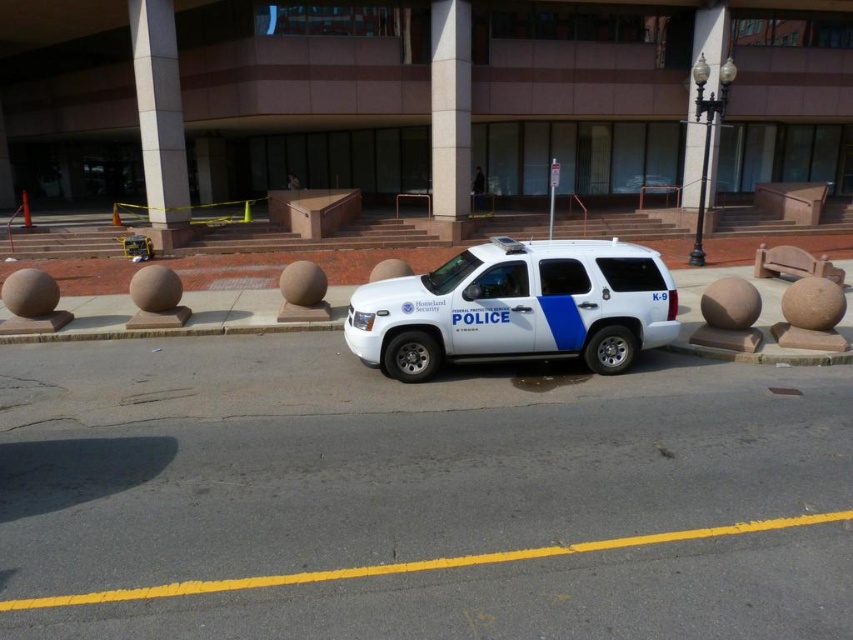
Question: Which of the following is the closest to the observer?

Choices:
 (A) click(x=381, y=342)
 (B) click(x=619, y=182)

Answer: (A)

Question: Does white matte/police van at center come in front of white matte police suv at center?

Choices:
 (A) yes
 (B) no

Answer: (A)

Question: Among these points, which one is nearest to the camera?

Choices:
 (A) pyautogui.click(x=418, y=296)
 (B) pyautogui.click(x=660, y=182)

Answer: (A)

Question: Observing the image, what is the correct spatial positioning of white matte/police van at center in reference to white matte police suv at center?

Choices:
 (A) below
 (B) above

Answer: (A)

Question: Does white matte/police van at center lie behind white matte police suv at center?

Choices:
 (A) yes
 (B) no

Answer: (B)